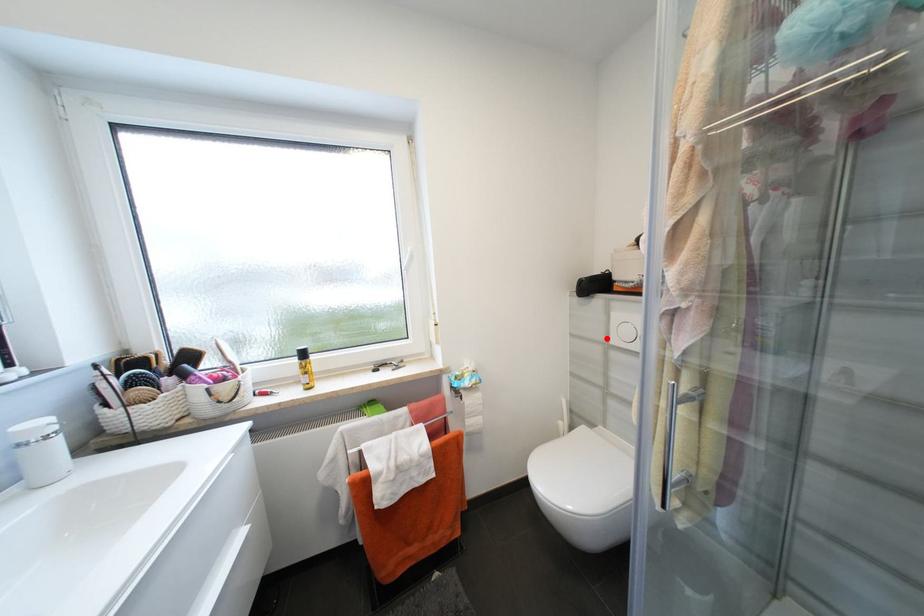
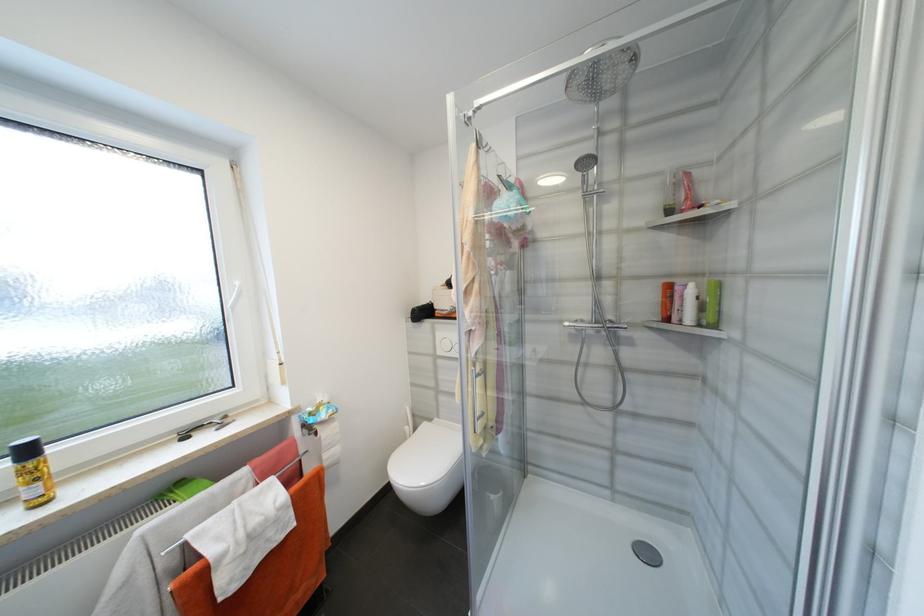
The point at the highlighted location is marked in the first image. Where is the corresponding point in the second image?

(436, 352)